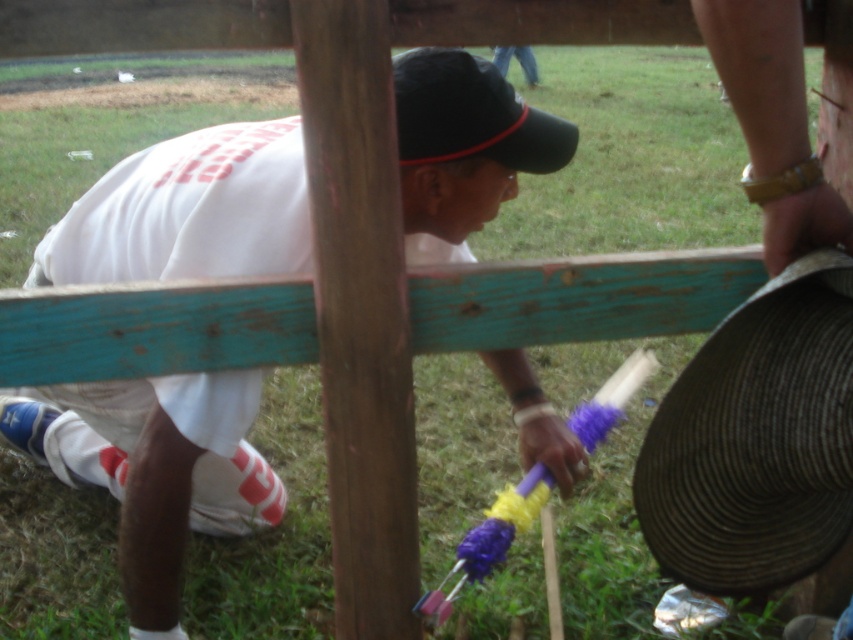
Is point (202, 234) positioned behind point (780, 486)?

That is True.

Does white matte shirt at center lie behind brown woven hat at lower right?

Yes.

Who is more forward, (183,470) or (817,470)?

Point (817,470) is in front.

You are a GUI agent. You are given a task and a screenshot of the screen. Output one action in this format:
    pyautogui.click(x=<x>, y=<y>)
    Task: Click on the white matte shirt at center
    This screenshot has width=853, height=640.
    Given the screenshot: What is the action you would take?
    pyautogui.click(x=155, y=468)

Who is shorter, brown woven hat at lower right or black fabric baseball hat at center?

With less height is black fabric baseball hat at center.

Based on the photo, can you confirm if brown woven hat at lower right is shorter than black fabric baseball hat at center?

Incorrect, brown woven hat at lower right's height does not fall short of black fabric baseball hat at center's.

Is point (781, 326) less distant than point (457, 100)?

Yes, it is.

This screenshot has height=640, width=853. In order to click on brown woven hat at lower right in this screenshot , I will do `click(756, 440)`.

Is point (347, 129) positioned behind point (416, 131)?

No.

Based on the photo, which of these two, brown wood pole at center or black fabric baseball hat at center, stands shorter?

Standing shorter between the two is black fabric baseball hat at center.

Locate an element on the screen. Image resolution: width=853 pixels, height=640 pixels. brown wood pole at center is located at coordinates (360, 310).